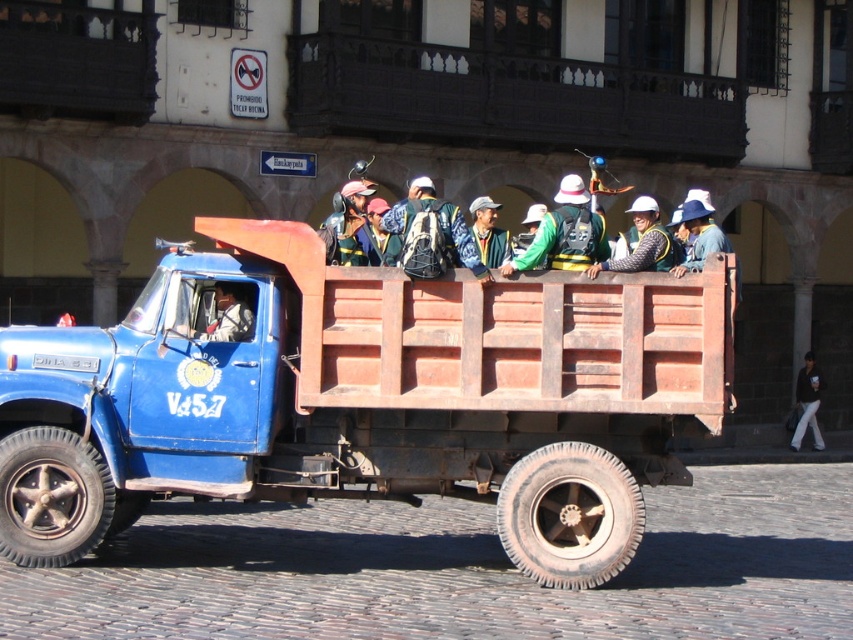
You are a pedestrian standing on the cobblestone street near the blue truck with a red cargo bed. You see a green fabric jacket at center and a blue fabric backpack at center. Which item is nearer to you?

The green fabric jacket at center is closer to the viewer than the blue fabric backpack at center.

You are standing in front of the blue truck and want to take a photo of both point (x=83, y=448) and point (x=392, y=212). Which point will appear larger in your photo?

Point (x=83, y=448) will appear larger in your photo because it is closer to the camera than point (x=392, y=212).